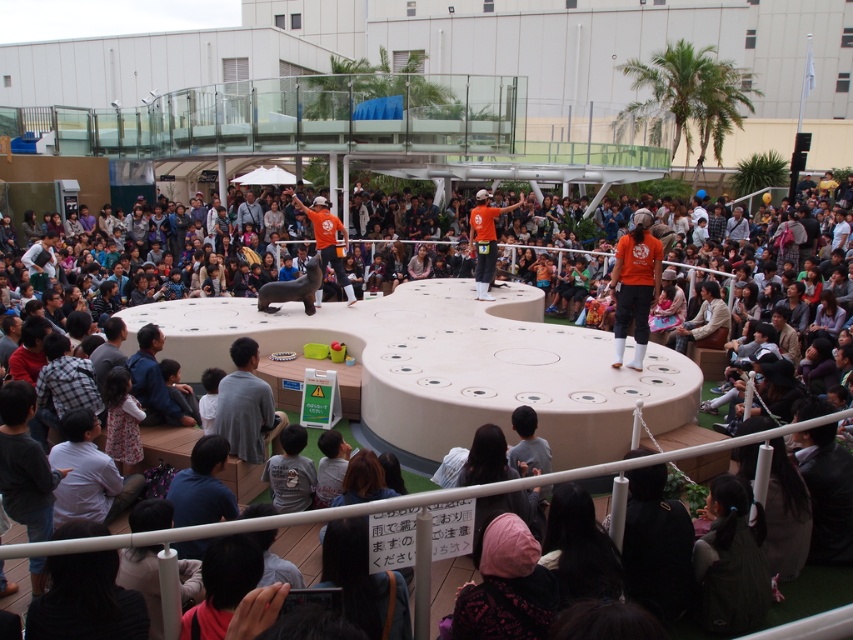
Looking at this image, you are a photographer at the event and want to capture a clear photo of both the orange fabric shirt at center and the orange fabric man at center. Which object should you focus on first to ensure sharpness, considering their sizes?

The orange fabric shirt at center is thinner than the orange fabric man at center, so you should focus on the orange fabric man at center first since it has a larger size and will require more precise focusing to ensure sharpness.

You are a visitor at the event and want to take a photo of the orange fabric shirt at center and orange fabric man at center together in the same frame. Given that your camera has a maximum focus range of 2.5 meters, will you be able to capture both subjects clearly in one shot?

The orange fabric shirt at center and orange fabric man at center are 2.72 meters apart. Since your camera can only focus up to 2.5 meters, the distance between them exceeds the maximum focus range. Therefore, you won not be able to capture both subjects clearly in one shot.